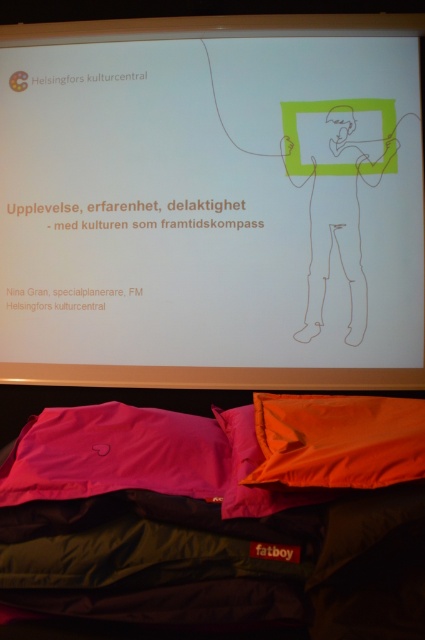
Question: Based on their relative distances, which object is nearer to the white paper at upper center?

Choices:
 (A) orange fabric pillow at lower center
 (B) brown line drawing man at upper right
 (C) orange fabric pillow at lower right
 (D) pink fabric pillow at lower left

Answer: (B)

Question: Is orange fabric pillow at lower right to the right of orange fabric pillow at lower center from the viewer's perspective?

Choices:
 (A) yes
 (B) no

Answer: (A)

Question: Is pink fabric pillow at lower left to the left of orange fabric pillow at lower right from the viewer's perspective?

Choices:
 (A) yes
 (B) no

Answer: (A)

Question: Among these points, which one is nearest to the camera?

Choices:
 (A) (138, 262)
 (B) (142, 460)

Answer: (B)

Question: Which object appears closest to the camera in this image?

Choices:
 (A) orange fabric pillow at lower center
 (B) pink fabric pillow at lower left

Answer: (A)

Question: Is white paper at upper center positioned behind brown line drawing man at upper right?

Choices:
 (A) yes
 (B) no

Answer: (B)